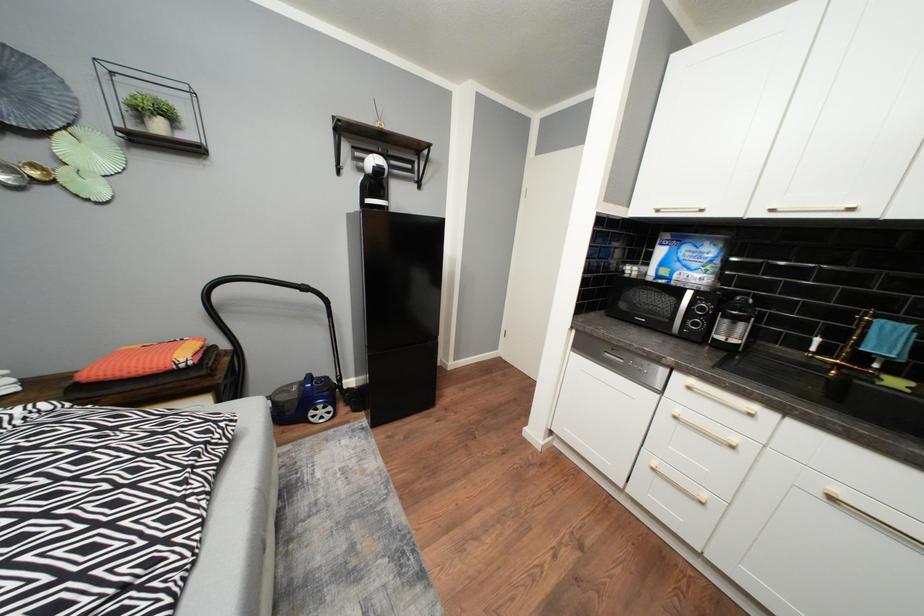
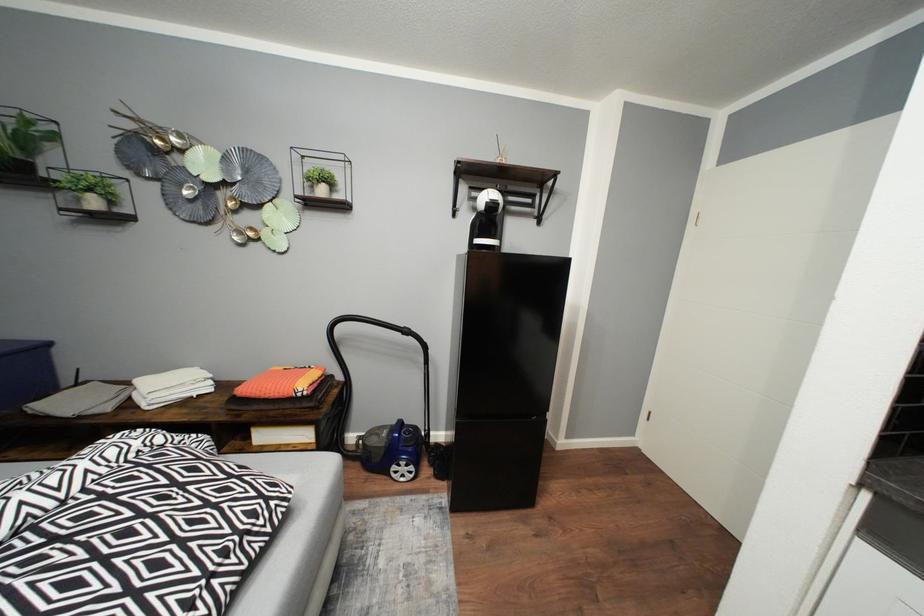
Question: What movement of the cameraman would produce the second image?

Choices:
 (A) Left
 (B) Right
 (C) Forward
 (D) Backward

Answer: (C)